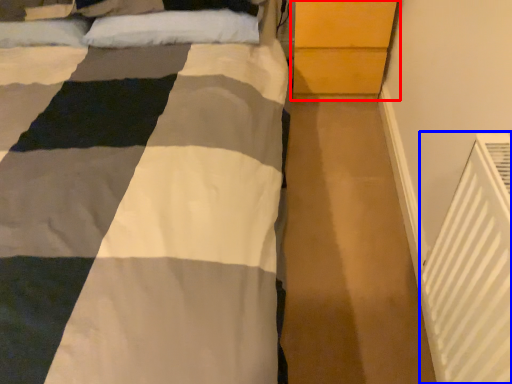
Question: Which object appears farthest to the camera in this image, dresser (highlighted by a red box) or air conditioning (highlighted by a blue box)?

Choices:
 (A) dresser
 (B) air conditioning

Answer: (A)